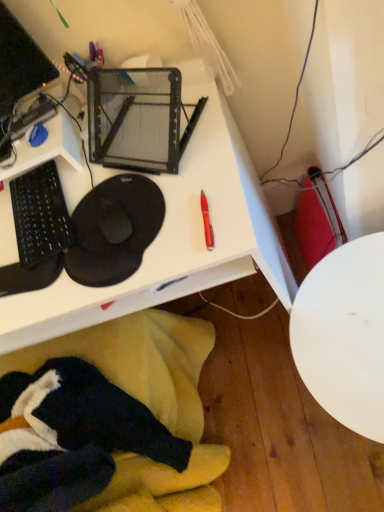
Locate an element on the screen. This screenshot has height=512, width=384. vacant space behind black matte mouse pad at left is located at coordinates (96, 142).